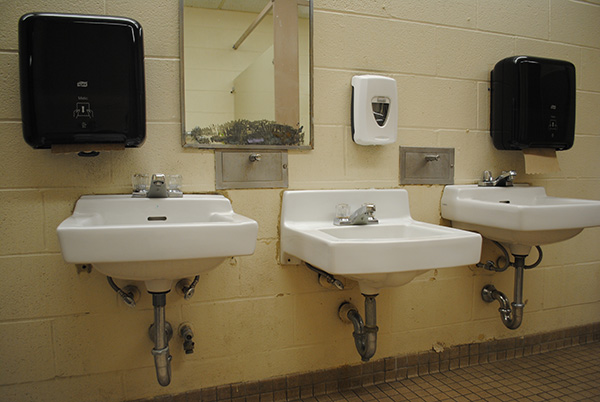
Locate an element on the screen. The height and width of the screenshot is (402, 600). reflection of wall in mirror is located at coordinates (214, 76).